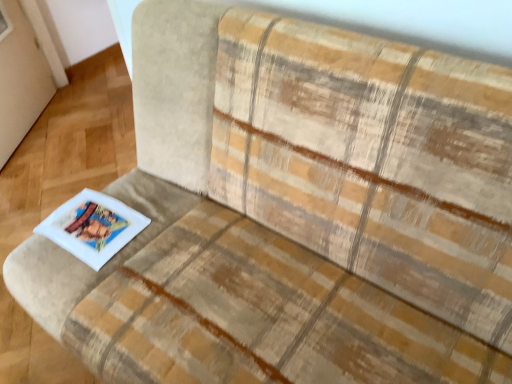
Image resolution: width=512 pixels, height=384 pixels. What are the coordinates of `white glossy book at lower left` in the screenshot? It's located at (93, 226).

What do you see at coordinates (93, 226) in the screenshot? I see `white glossy book at lower left` at bounding box center [93, 226].

Find the location of a particular element. The width and height of the screenshot is (512, 384). white glossy book at lower left is located at coordinates (93, 226).